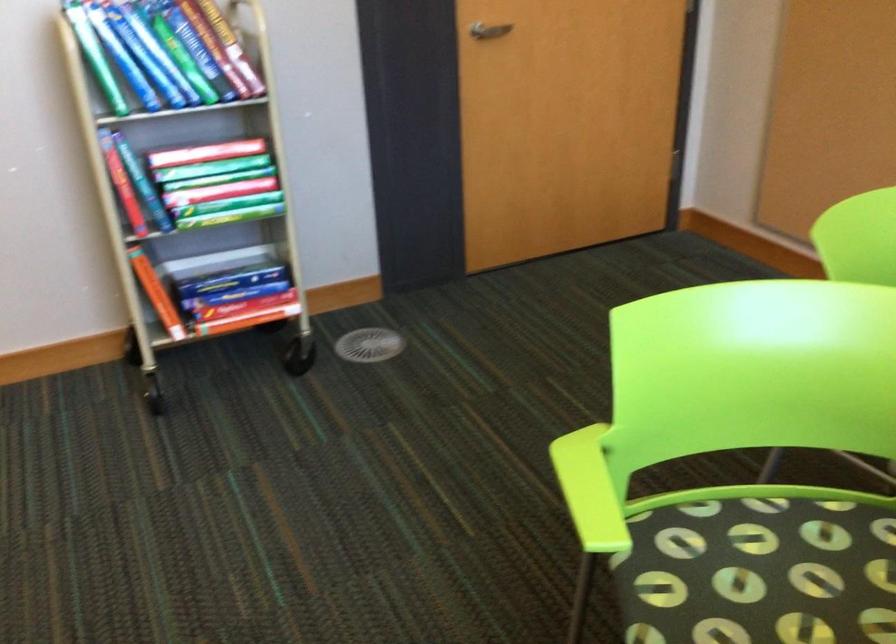
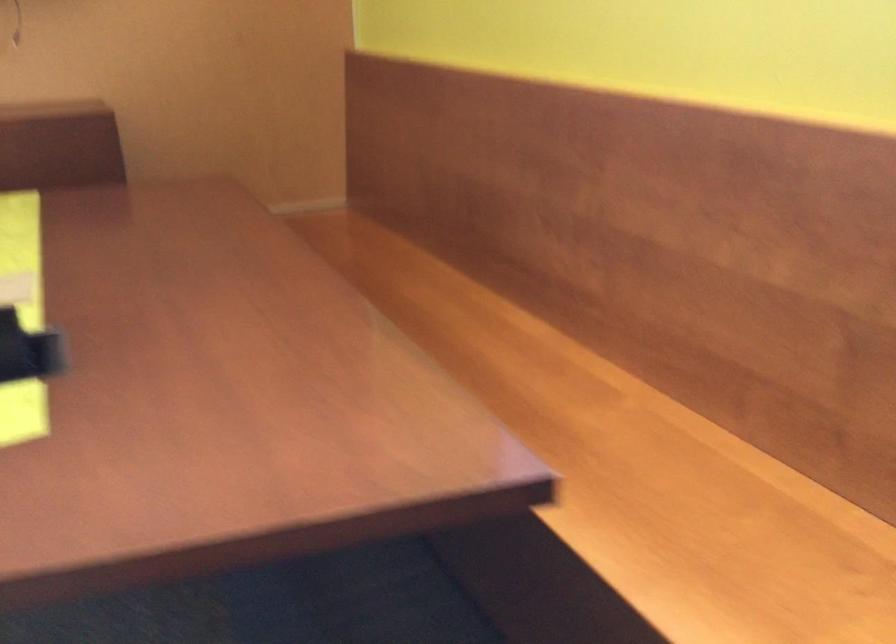
Based on the continuous images, in which direction is the camera rotating?

The camera rotated toward right-down.